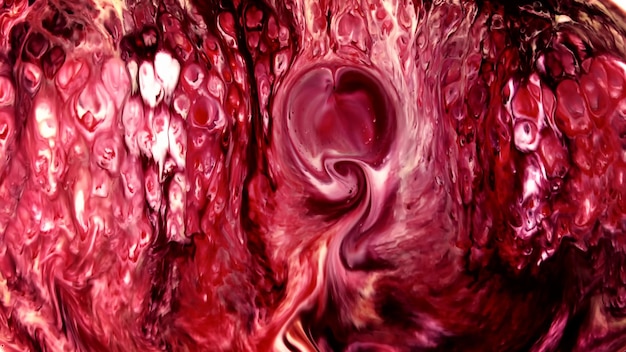
In order to click on paint in this screenshot , I will do `click(424, 287)`.